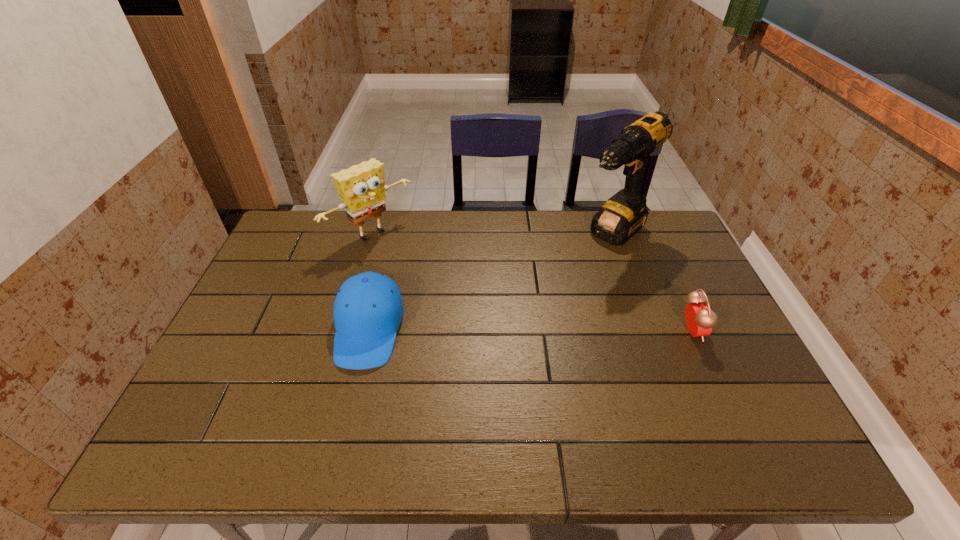
Identify the location of free spot located 0.340m at the tip of the drill. The image size is (960, 540). (530, 314).

Identify the location of vacant space located at the tip of the drill. (582, 265).

The width and height of the screenshot is (960, 540). What are the coordinates of `sponge at the far edge` in the screenshot? It's located at (362, 188).

The image size is (960, 540). I want to click on drill that is at the far edge, so (x=623, y=215).

Where is `alarm clock present at the right edge`? Image resolution: width=960 pixels, height=540 pixels. alarm clock present at the right edge is located at coordinates (700, 320).

This screenshot has width=960, height=540. I want to click on drill that is at the right edge, so click(623, 215).

Locate an element on the screen. object located at the far right corner is located at coordinates (623, 215).

This screenshot has width=960, height=540. What are the coordinates of `vacant space at the far edge` in the screenshot? It's located at (520, 213).

Identify the location of vacant area at the near edge of the desktop. This screenshot has width=960, height=540. (451, 390).

You are a GUI agent. You are given a task and a screenshot of the screen. Output one action in this format:
    pyautogui.click(x=<x>, y=<y>)
    Task: Click on the vacant space at the left edge
    
    Given the screenshot: What is the action you would take?
    click(x=284, y=274)